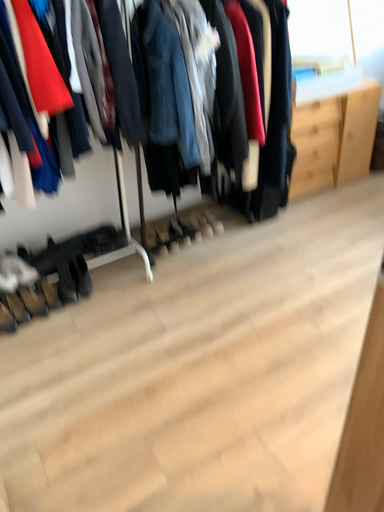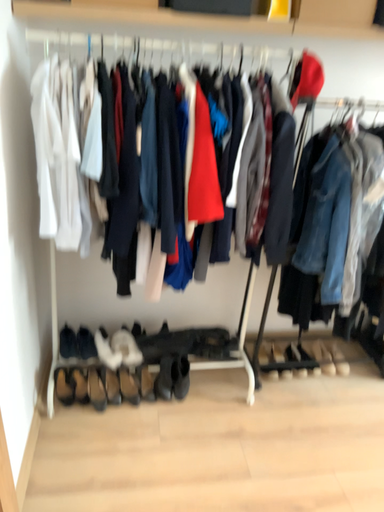
Question: How did the camera likely rotate when shooting the video?

Choices:
 (A) rotated right
 (B) rotated left

Answer: (B)